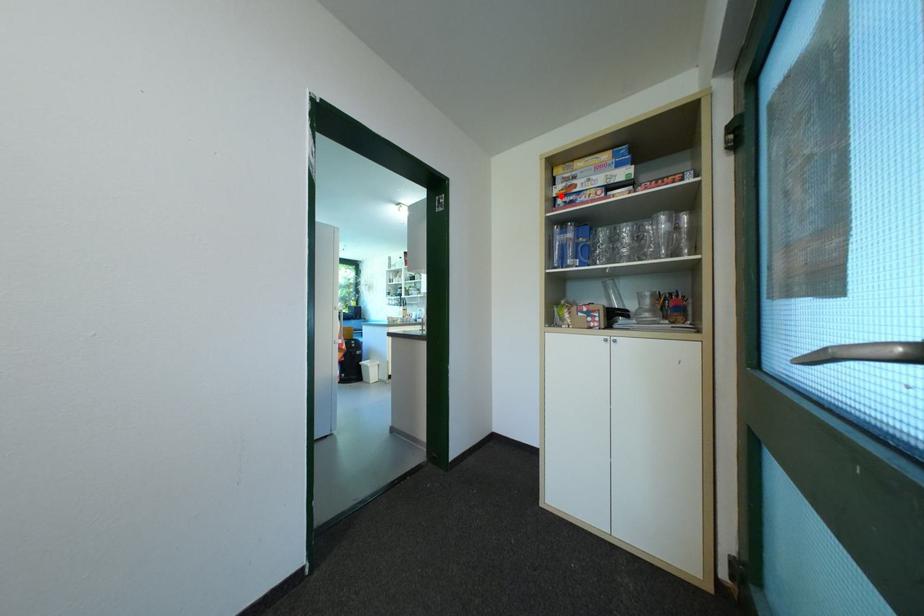
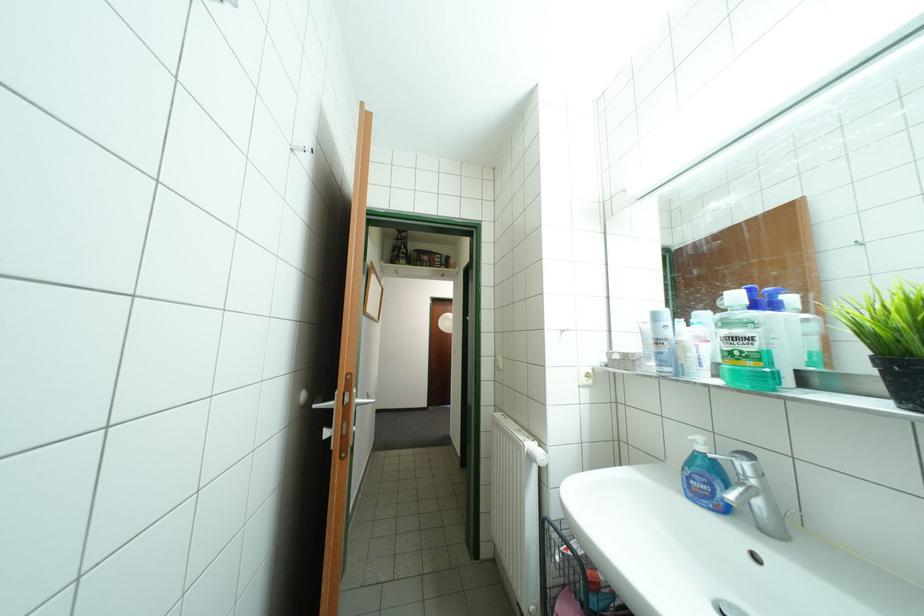
Question: I am providing you with two images of the same scene from different viewpoints. A red point is marked on the first image. Is the red point's position out of view in image 2?

Choices:
 (A) Yes
 (B) No

Answer: (A)